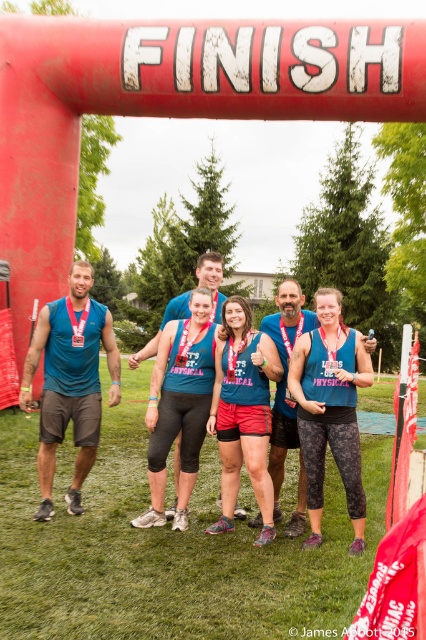
You are standing at the finish line under the large red inflatable archway. You notice two points marked in the scene. Which point, point (x=325, y=428) or point (x=213, y=524), is closer to you?

Point (x=325, y=428) is closer to the viewer than point (x=213, y=524).

Looking at the group under the red archway, which tank top is positioned to the right of the other between the blue fabric tank top at center and the teal fabric tank top at center?

The blue fabric tank top at center is to the right of the teal fabric tank top at center.

You are a photographer at the finish line and want to ensure both the blue fabric tank top at center and the teal fabric tank top at center are clearly visible in your photo. Based on their sizes, which tank top should you focus on to capture more details?

The blue fabric tank top at center has a greater height compared to the teal fabric tank top at center, so focusing on the blue fabric tank top at center will allow you to capture more details due to its larger size.